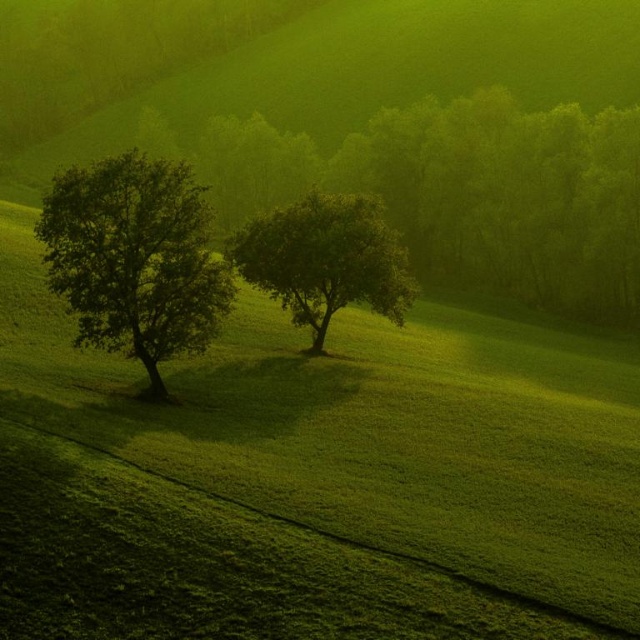
Question: Which point appears farthest from the camera in this image?

Choices:
 (A) (262, 272)
 (B) (100, 323)

Answer: (A)

Question: Does green leafy tree at left have a larger size compared to green leafy tree at center?

Choices:
 (A) no
 (B) yes

Answer: (A)

Question: Does green grassy field at center appear under green leafy tree at left?

Choices:
 (A) no
 (B) yes

Answer: (B)

Question: Is green leafy tree at left behind green leafy tree at center?

Choices:
 (A) yes
 (B) no

Answer: (B)

Question: Which object is closer to the camera taking this photo?

Choices:
 (A) green leafy tree at center
 (B) green grassy field at center

Answer: (B)

Question: Which is nearer to the green leafy tree at left?

Choices:
 (A) green leafy tree at center
 (B) green grassy field at center

Answer: (B)